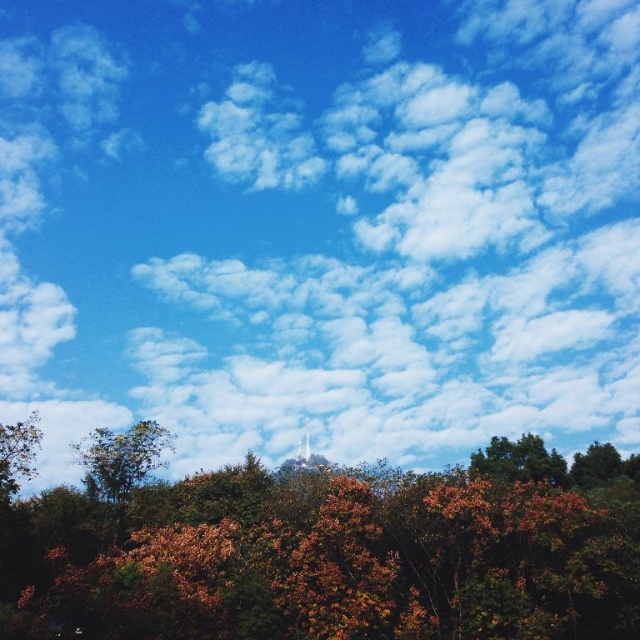
You are standing in the forest looking at the brown matte tree at lower center and the green matte tree at lower right. Which tree would appear larger to you?

The brown matte tree at lower center is closer to the viewer than the green matte tree at lower right, so it would appear larger.

You are standing in the forest and want to reach the distant tower. You have two paths available. One goes past the brown matte tree at lower center and the other goes past the green leafy tree at left. Which path would be shorter if you want to reach the tower quickly?

The path past the brown matte tree at lower center is shorter because it is closer to the viewer, meaning it is nearer to your current position. The green leafy tree at left is farther away, so taking that path would require traveling a greater distance.